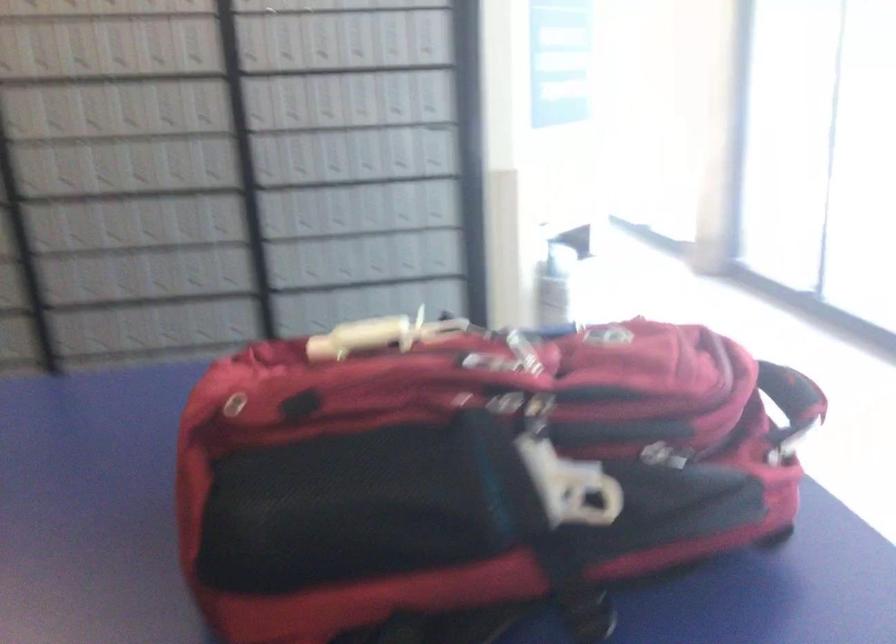
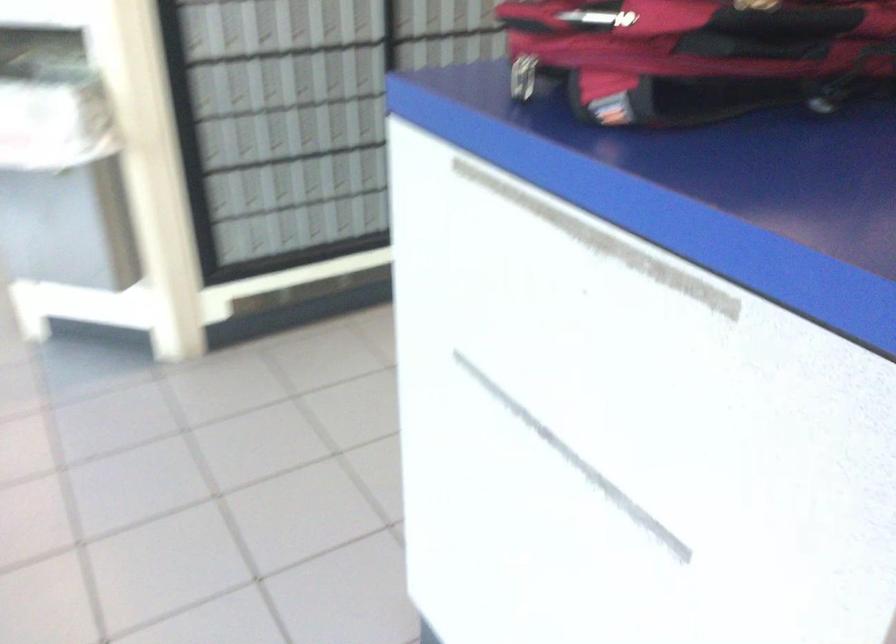
In the second image, find the point that corresponds to pixel 606 382 in the first image.

(696, 55)